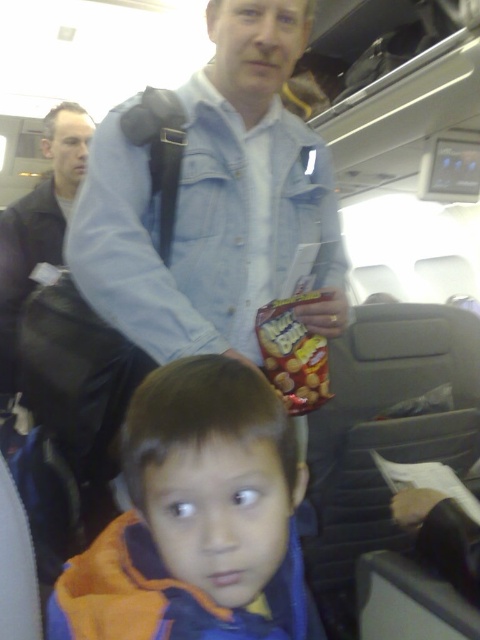
Is orange fleece jacket at lower left taller than matte plastic snack packet at center?

Indeed, orange fleece jacket at lower left has a greater height compared to matte plastic snack packet at center.

Who is shorter, orange fleece jacket at lower left or matte plastic snack packet at center?

With less height is matte plastic snack packet at center.

I want to click on orange fleece jacket at lower left, so point(196,518).

Locate an element on the screen. The height and width of the screenshot is (640, 480). orange fleece jacket at lower left is located at coordinates (196, 518).

Does denim jacket at upper center have a lesser height compared to matte plastic snack packet at center?

No.

Between denim jacket at upper center and matte plastic snack packet at center, which one appears on the left side from the viewer's perspective?

denim jacket at upper center is more to the left.

Is point (191, 186) closer to viewer compared to point (284, 381)?

No, it is behind (284, 381).

This screenshot has height=640, width=480. What are the coordinates of `denim jacket at upper center` in the screenshot? It's located at (214, 202).

Does denim jacket at upper center have a smaller size compared to matte black jacket at left?

Yes.

Can you confirm if denim jacket at upper center is shorter than matte black jacket at left?

Yes, denim jacket at upper center is shorter than matte black jacket at left.

Between point (257, 358) and point (67, 148), which one is positioned in front?

Point (257, 358)

You are a GUI agent. You are given a task and a screenshot of the screen. Output one action in this format:
    pyautogui.click(x=<x>, y=<y>)
    Task: Click on the denim jacket at upper center
    
    Given the screenshot: What is the action you would take?
    pyautogui.click(x=214, y=202)